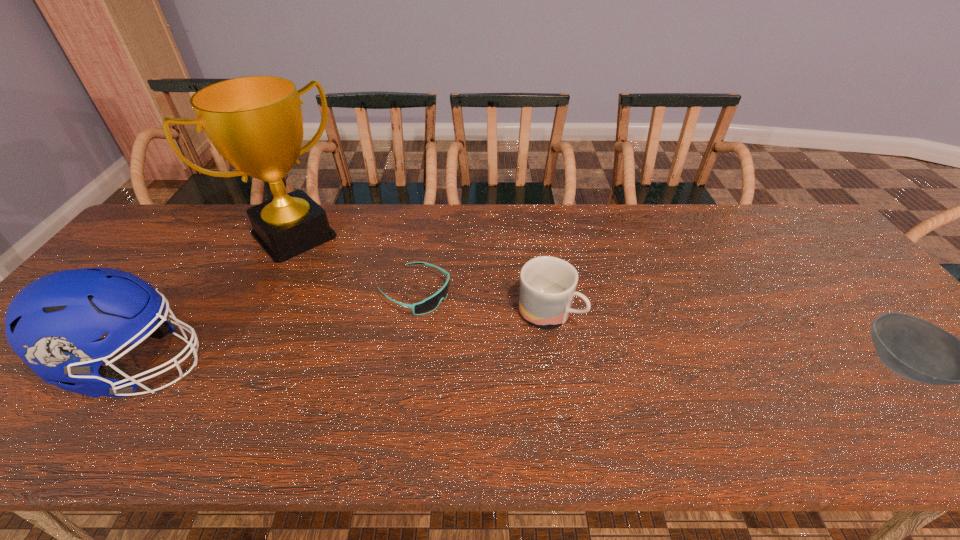
Identify the location of free space located 0.170m on the front-facing side of the third object from left to right. (497, 336).

Identify the location of vacant area situated 0.070m on the front-facing side of the tallest object. The width and height of the screenshot is (960, 540). (329, 269).

Find the location of a particular element. vacant area situated 0.170m on the front-facing side of the tallest object is located at coordinates (348, 287).

The height and width of the screenshot is (540, 960). What are the coordinates of `vacant point located on the front-facing side of the tallest object` in the screenshot? It's located at (367, 307).

Where is `blank area located 0.210m on the side with the handle of the third shortest object`? This screenshot has width=960, height=540. blank area located 0.210m on the side with the handle of the third shortest object is located at coordinates (651, 378).

You are a GUI agent. You are given a task and a screenshot of the screen. Output one action in this format:
    pyautogui.click(x=<x>, y=<y>)
    Task: Click on the vacant space situated on the side with the handle of the third shortest object
    The image size is (960, 540).
    Given the screenshot: What is the action you would take?
    coord(609,352)

Locate an element on the screen. vacant space located 0.180m on the side with the handle of the third shortest object is located at coordinates (639, 370).

At what (x,y) coordinates should I click in order to perform the action: click on object located in the far edge section of the desktop. Please return your answer as a coordinate pair (x, y). Image resolution: width=960 pixels, height=540 pixels. Looking at the image, I should click on (255, 122).

Where is `object at the near edge`? Image resolution: width=960 pixels, height=540 pixels. object at the near edge is located at coordinates (54, 324).

Image resolution: width=960 pixels, height=540 pixels. I want to click on object present at the left edge, so click(x=54, y=324).